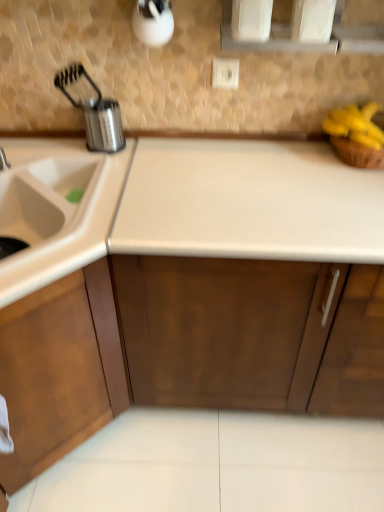
The height and width of the screenshot is (512, 384). What are the coordinates of `vacant area to the left of yellow matte bananas at upper right` in the screenshot? It's located at (294, 153).